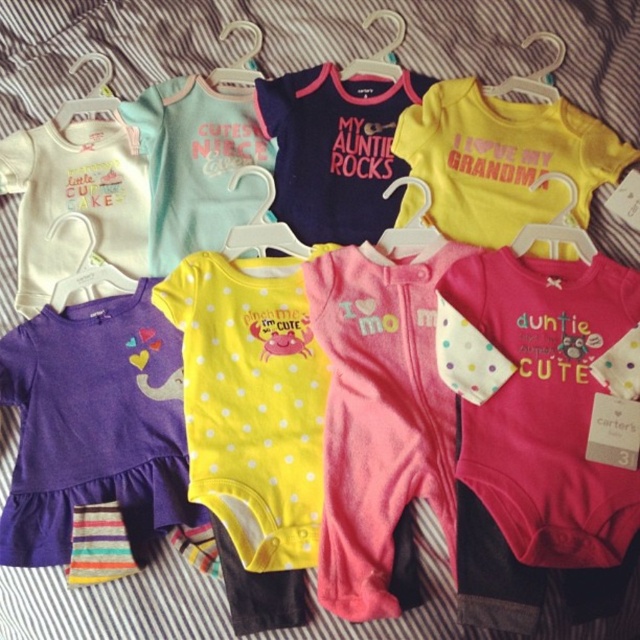
You are organizing a baby clothing store and need to decide which item to place on a shelf that can only hold items shorter than 30 cm. The purple soft fabric dress at lower left and the yellow polka dot onesie at center are both candidates. Based on their heights, which one should you choose?

The purple soft fabric dress at lower left has a lesser height compared to the yellow polka dot onesie at center, so it should be placed on the shelf since it is shorter.

You are a parent trying to pack for your baby. You have a small suitcase that can only fit clothing items narrower than 12 inches. You see the purple soft fabric dress at lower left and the yellow polka dot onesie at center. Which of these items can fit into the suitcase?

The purple soft fabric dress at lower left is wider than the yellow polka dot onesie at center. Since the suitcase can only fit items narrower than 12 inches, the yellow polka dot onesie at center might fit, but the purple soft fabric dress at lower left is wider and may not fit. However, without knowing the exact width of the yellow onesie, we can only conclude that the purple dress is wider and thus less likely to fit.